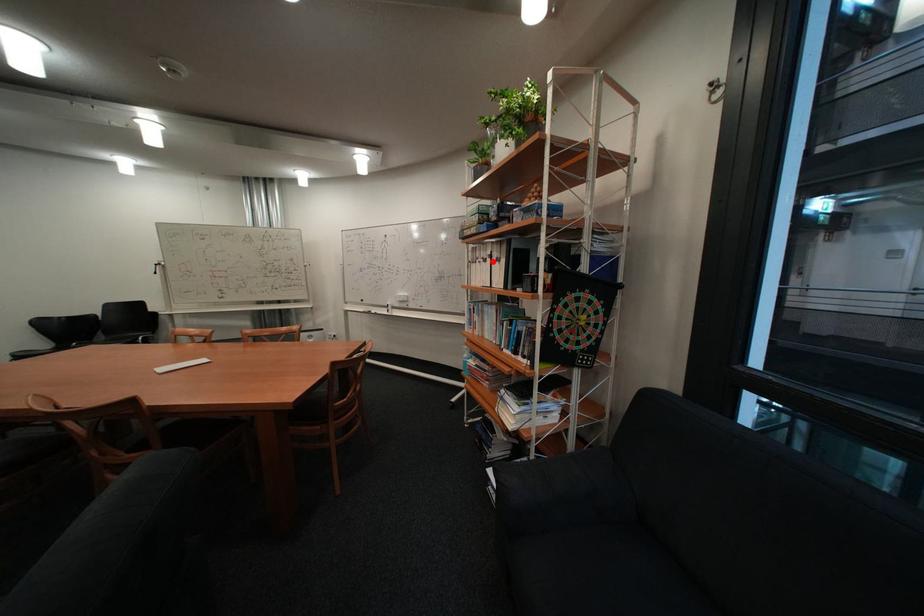
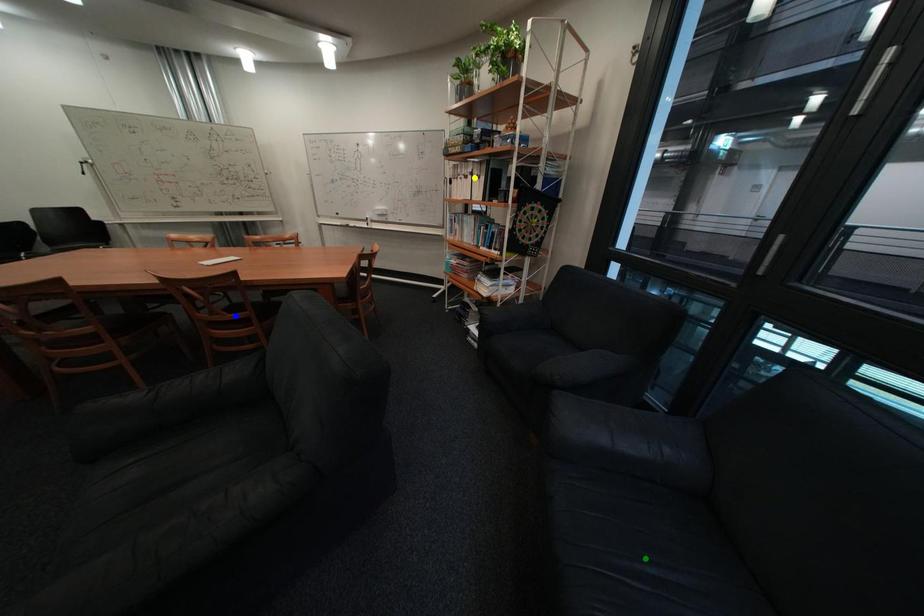
Question: I am providing you with two images of the same scene from different viewpoints. A red point is marked on the first image. You are given multiple points on the second image. Which point in image 2 represents the same 3d spot as the red point in image 1?

Choices:
 (A) yellow point
 (B) blue point
 (C) green point

Answer: (A)